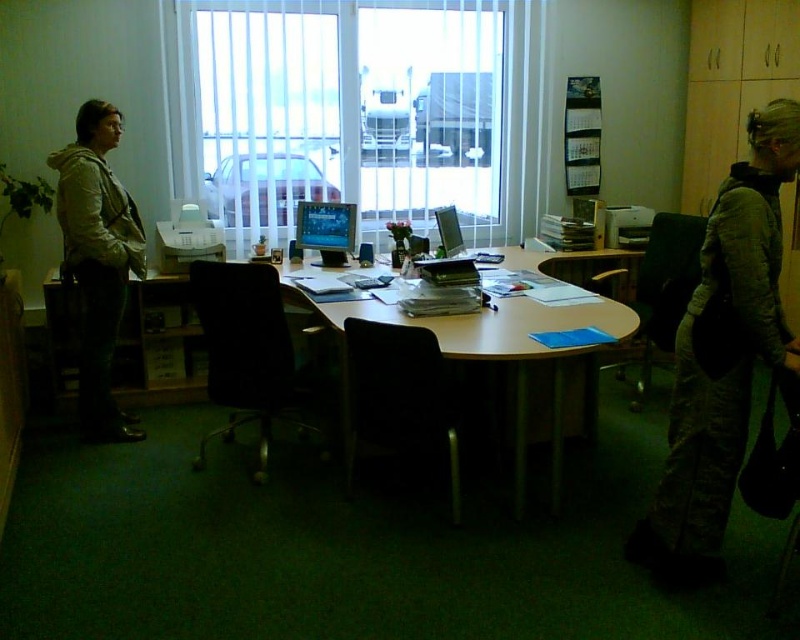
Looking at this image, is white vertical blinds at center to the right of green corduroy jacket at right from the viewer's perspective?

In fact, white vertical blinds at center is to the left of green corduroy jacket at right.

Is white vertical blinds at center bigger than green corduroy jacket at right?

Yes, white vertical blinds at center is bigger than green corduroy jacket at right.

Which is in front, point (436, 147) or point (764, 131)?

Point (764, 131) is more forward.

Where is `white vertical blinds at center`? white vertical blinds at center is located at coordinates (344, 109).

The height and width of the screenshot is (640, 800). Describe the element at coordinates (248, 353) in the screenshot. I see `black fabric swivel chair at center` at that location.

Is black fabric swivel chair at center thinner than wooden table at center?

Indeed, black fabric swivel chair at center has a lesser width compared to wooden table at center.

Identify the location of black fabric swivel chair at center. The width and height of the screenshot is (800, 640). (248, 353).

Is white vertical blinds at center positioned behind black fabric swivel chair at center?

That is True.

Does white vertical blinds at center appear over black fabric swivel chair at center?

Yes.

Between point (240, 83) and point (264, 346), which one is positioned in front?

Point (264, 346) is in front.

This screenshot has width=800, height=640. In order to click on white vertical blinds at center in this screenshot , I will do `click(344, 109)`.